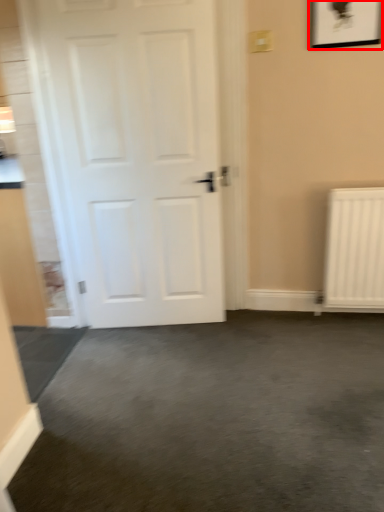
Question: Where is picture frame (annotated by the red box) located in relation to door in the image?

Choices:
 (A) right
 (B) left

Answer: (A)